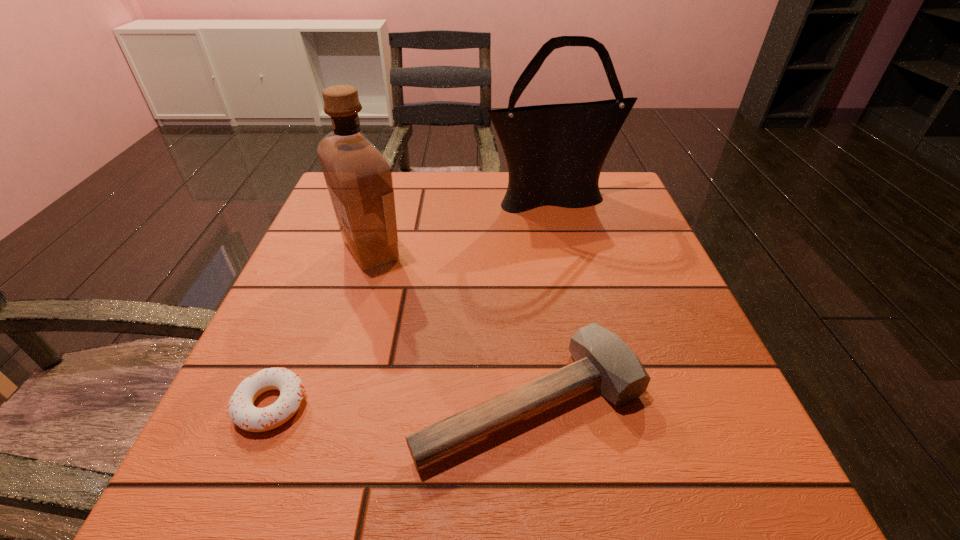
Where is `liquor present at the left edge`? The image size is (960, 540). liquor present at the left edge is located at coordinates (358, 176).

This screenshot has height=540, width=960. Identify the location of doughnut that is positioned at the left edge. (242, 412).

You are a GUI agent. You are given a task and a screenshot of the screen. Output one action in this format:
    pyautogui.click(x=<x>, y=<y>)
    Task: Click on the shoulder bag present at the right edge
    
    Given the screenshot: What is the action you would take?
    pyautogui.click(x=555, y=153)

You are a GUI agent. You are given a task and a screenshot of the screen. Output one action in this format:
    pyautogui.click(x=<x>, y=<y>)
    Task: Click on the mallet at the right edge
    The height and width of the screenshot is (540, 960).
    Given the screenshot: What is the action you would take?
    pyautogui.click(x=602, y=360)

This screenshot has width=960, height=540. What are the coordinates of `object situated at the far right corner` in the screenshot? It's located at (555, 153).

Locate an element on the screen. The image size is (960, 540). object that is at the near right corner is located at coordinates (602, 360).

At what (x,y) coordinates should I click in order to perform the action: click on vacant area at the far edge of the desktop. Please return your answer as a coordinate pair (x, y). The image size is (960, 540). Looking at the image, I should click on (426, 195).

Find the location of a particular element. The width and height of the screenshot is (960, 540). free space at the left edge of the desktop is located at coordinates (339, 286).

The width and height of the screenshot is (960, 540). I want to click on vacant space at the right edge, so click(x=693, y=435).

Image resolution: width=960 pixels, height=540 pixels. What are the coordinates of `vacant space at the far left corner of the desktop` in the screenshot? It's located at (397, 175).